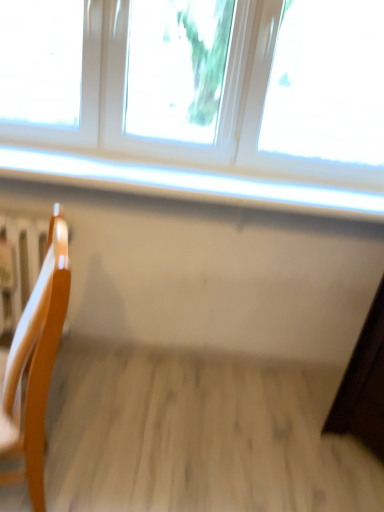
Question: From a real-world perspective, is light wood chair at left above or below white glossy window sill at upper center?

Choices:
 (A) above
 (B) below

Answer: (B)

Question: Is light wood chair at left wider or thinner than white glossy window sill at upper center?

Choices:
 (A) wide
 (B) thin

Answer: (B)

Question: Which object is the closest to the white plastic window at upper center?

Choices:
 (A) wooden radiator at left
 (B) white glossy window sill at upper center
 (C) light wood chair at left

Answer: (B)

Question: Which object is positioned farthest from the light wood chair at left?

Choices:
 (A) white glossy window sill at upper center
 (B) wooden radiator at left
 (C) white plastic window at upper center

Answer: (C)